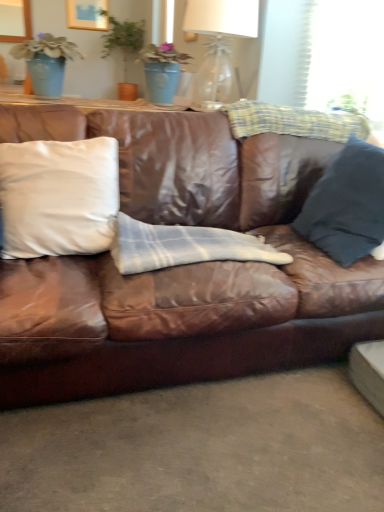
What is the approximate height of white plaid blanket at center?

5.30 inches.

Consider the image. In order to face matte blue pot at upper left, should I rotate leftwards or rightwards?

A 18.282 degree turn to the left will do.

This screenshot has width=384, height=512. In order to click on dark blue fabric pillow at right, the first pillow in the right-to-left sequence in this screenshot , I will do `click(347, 204)`.

You are a GUI agent. You are given a task and a screenshot of the screen. Output one action in this format:
    pyautogui.click(x=<x>, y=<y>)
    Task: Click on the brown leather couch at center
    The height and width of the screenshot is (512, 384).
    Given the screenshot: What is the action you would take?
    pyautogui.click(x=181, y=268)

The width and height of the screenshot is (384, 512). Describe the element at coordinates (58, 197) in the screenshot. I see `white matte pillow at left, which appears as the 2th pillow when viewed from the right` at that location.

Identify the location of translucent glass table lamp at upper center. (218, 44).

From a real-world perspective, is translucent glass table lamp at upper center over brown leather couch at center?

Yes, from a real-world perspective, translucent glass table lamp at upper center is over brown leather couch at center

Considering the points (194, 92) and (302, 343), which point is in front, point (194, 92) or point (302, 343)?

Point (302, 343)

Is translucent glass table lamp at upper center completely or partially outside of brown leather couch at center?

translucent glass table lamp at upper center is positioned outside brown leather couch at center.

Is the depth of translucent glass table lamp at upper center greater than that of brown leather couch at center?

Yes.

How much distance is there between white matte pillow at left, which is the 1th pillow from left to right, and white plaid blanket at center?

white matte pillow at left, which is the 1th pillow from left to right, and white plaid blanket at center are 26.05 centimeters apart.

Find the location of a particular element. material behind the white matte pillow at left, which appears as the 2th pillow when viewed from the right is located at coordinates 184,246.

Between white matte pillow at left, which appears as the 2th pillow when viewed from the right, and white plaid blanket at center, which one has larger size?

Bigger between the two is white matte pillow at left, which appears as the 2th pillow when viewed from the right.

Is white plaid blanket at center inside or outside of matte blue pot at upper left?

white plaid blanket at center cannot be found inside matte blue pot at upper left.

Consider the image. Measure the distance between white plaid blanket at center and matte blue pot at upper left.

A distance of 1.04 meters exists between white plaid blanket at center and matte blue pot at upper left.

Is point (273, 260) closer to camera compared to point (62, 69)?

That is True.

Is the surface of white plaid blanket at center in direct contact with matte blue pot at upper left?

They are not placed beside each other.

Where is `houseplant located above the white plaid blanket at center (from a real-world perspective)`? houseplant located above the white plaid blanket at center (from a real-world perspective) is located at coordinates (46, 62).

Is matte blue pot at upper left bigger than white plaid blanket at center?

Yes, matte blue pot at upper left is bigger than white plaid blanket at center.

From a real-world perspective, is matte blue pot at upper left physically below white plaid blanket at center?

No.

Can you confirm if brown leather couch at center is shorter than white matte pillow at left, which appears as the 2th pillow when viewed from the right?

In fact, brown leather couch at center may be taller than white matte pillow at left, which appears as the 2th pillow when viewed from the right.

From the image's perspective, is brown leather couch at center positioned above or below white matte pillow at left, which appears as the 2th pillow when viewed from the right?

brown leather couch at center is situated lower than white matte pillow at left, which appears as the 2th pillow when viewed from the right, in the image.

From a real-world perspective, who is located lower, brown leather couch at center or white matte pillow at left, which appears as the 2th pillow when viewed from the right?

From a 3D spatial view, brown leather couch at center is below.

How much distance is there between white plaid blanket at center and white matte pillow at left, which appears as the 2th pillow when viewed from the right?

A distance of 10.26 inches exists between white plaid blanket at center and white matte pillow at left, which appears as the 2th pillow when viewed from the right.

Which of these two, white plaid blanket at center or white matte pillow at left, which is the 1th pillow from left to right, is thinner?

Thinner between the two is white matte pillow at left, which is the 1th pillow from left to right.

From a real-world perspective, between white plaid blanket at center and white matte pillow at left, which is the 1th pillow from left to right, who is vertically lower?

In real-world perspective, white plaid blanket at center is lower.

Is white plaid blanket at center not within white matte pillow at left, which is the 1th pillow from left to right?

white plaid blanket at center is positioned outside white matte pillow at left, which is the 1th pillow from left to right.

Which is correct: dark blue fabric pillow at right, the first pillow in the right-to-left sequence, is inside white plaid blanket at center, or outside of it?

dark blue fabric pillow at right, the first pillow in the right-to-left sequence, is located beyond the bounds of white plaid blanket at center.

What's the angular difference between dark blue fabric pillow at right, which is the second pillow in left-to-right order, and white plaid blanket at center's facing directions?

The angle between the facing direction of dark blue fabric pillow at right, which is the second pillow in left-to-right order, and the facing direction of white plaid blanket at center is 91.3 degrees.

Between dark blue fabric pillow at right, which is the second pillow in left-to-right order, and white plaid blanket at center, which one has larger size?

With larger size is dark blue fabric pillow at right, which is the second pillow in left-to-right order.

Is dark blue fabric pillow at right, which is the second pillow in left-to-right order, to the right of white plaid blanket at center from the viewer's perspective?

Indeed, dark blue fabric pillow at right, which is the second pillow in left-to-right order, is positioned on the right side of white plaid blanket at center.

Locate an element on the screen. Image resolution: width=384 pixels, height=512 pixels. studio couch on the left side of translucent glass table lamp at upper center is located at coordinates (181, 268).

Image resolution: width=384 pixels, height=512 pixels. What are the coordinates of `material below the white matte pillow at left, which is the 1th pillow from left to right (from a real-world perspective)` in the screenshot? It's located at (184, 246).

Considering their positions, is matte blue pot at upper left positioned closer to dark blue fabric pillow at right, which is the second pillow in left-to-right order, than white plaid blanket at center?

white plaid blanket at center is positioned closer to the anchor dark blue fabric pillow at right, which is the second pillow in left-to-right order.

Based on their spatial positions, is matte blue pot at upper left or white plaid blanket at center closer to white matte pillow at left, which appears as the 2th pillow when viewed from the right?

Among the two, white plaid blanket at center is located nearer to white matte pillow at left, which appears as the 2th pillow when viewed from the right.

Looking at the image, which one is located further to white plaid blanket at center, white matte pillow at left, which is the 1th pillow from left to right, or matte blue pot at upper left?

matte blue pot at upper left lies further to white plaid blanket at center than the other object.

Looking at the image, which one is located closer to brown leather couch at center, matte blue pot at upper left or white plaid blanket at center?

white plaid blanket at center is positioned closer to the anchor brown leather couch at center.

Estimate the real-world distances between objects in this image. Which object is further from white matte pillow at left, which is the 1th pillow from left to right, translucent glass table lamp at upper center or dark blue fabric pillow at right, which is the second pillow in left-to-right order?

translucent glass table lamp at upper center lies further to white matte pillow at left, which is the 1th pillow from left to right, than the other object.

Looking at the image, which one is located further to brown leather couch at center, translucent glass table lamp at upper center or dark blue fabric pillow at right, which is the second pillow in left-to-right order?

Based on the image, translucent glass table lamp at upper center appears to be further to brown leather couch at center.

Estimate the real-world distances between objects in this image. Which object is further from dark blue fabric pillow at right, which is the second pillow in left-to-right order, white matte pillow at left, which is the 1th pillow from left to right, or translucent glass table lamp at upper center?

Among the two, translucent glass table lamp at upper center is located further to dark blue fabric pillow at right, which is the second pillow in left-to-right order.

Estimate the real-world distances between objects in this image. Which object is further from dark blue fabric pillow at right, the first pillow in the right-to-left sequence, translucent glass table lamp at upper center or matte blue pot at upper left?

matte blue pot at upper left lies further to dark blue fabric pillow at right, the first pillow in the right-to-left sequence, than the other object.

Identify the location of houseplant between translucent glass table lamp at upper center and white plaid blanket at center in the vertical direction. (46, 62).

This screenshot has height=512, width=384. Find the location of `houseplant between brown leather couch at center and translucent glass table lamp at upper center along the z-axis`. houseplant between brown leather couch at center and translucent glass table lamp at upper center along the z-axis is located at coordinates (46, 62).

Locate an element on the screen. This screenshot has width=384, height=512. studio couch that lies between matte blue pot at upper left and white plaid blanket at center from top to bottom is located at coordinates (181, 268).

At what (x,y) coordinates should I click in order to perform the action: click on material between matte blue pot at upper left and dark blue fabric pillow at right, which is the second pillow in left-to-right order, from left to right. Please return your answer as a coordinate pair (x, y). Image resolution: width=384 pixels, height=512 pixels. Looking at the image, I should click on (184, 246).